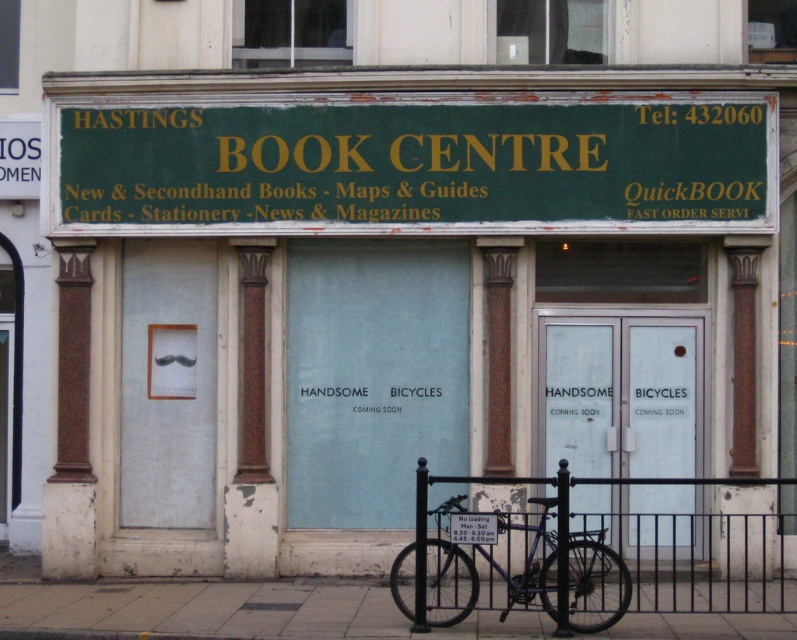
You are a delivery person standing on the concrete sidewalk at lower center and need to place a package on the green painted wood signboard at upper center. Can you reach it without any tools?

The green painted wood signboard at upper center and concrete sidewalk at lower center are 9.81 feet apart. Since the distance is too large to reach without tools, you cannot place the package on the signboard without assistance.

What is located at the point with coordinates [423,164] on the storefront of Hastings Book Centre?

The green painted wood signboard at upper center is located at point [423,164].